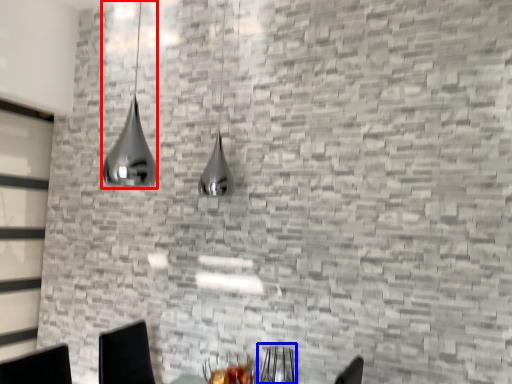
Question: Which of the following is the farthest to the observer, lamp (highlighted by a red box) or armchair (highlighted by a blue box)?

Choices:
 (A) lamp
 (B) armchair

Answer: (B)